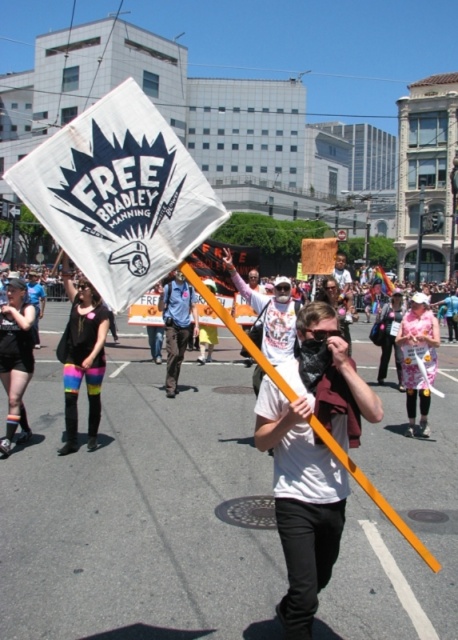
Is white matte t-shirt at center bigger than rainbow striped leggings at left?

Actually, white matte t-shirt at center might be smaller than rainbow striped leggings at left.

Can you confirm if white matte t-shirt at center is positioned to the left of rainbow striped leggings at left?

In fact, white matte t-shirt at center is to the right of rainbow striped leggings at left.

Find the location of `white matte t-shirt at center`. white matte t-shirt at center is located at coordinates click(x=311, y=458).

The image size is (458, 640). Identify the location of white matte t-shirt at center. (311, 458).

From the picture: Who is more distant from viewer, [409,381] or [185,344]?

Point [185,344]

Does point (413, 353) lie behind point (174, 339)?

No, it is in front of (174, 339).

Where is `pink floral dress at center`? pink floral dress at center is located at coordinates (418, 358).

Does point (103, 312) lie behind point (412, 406)?

That is False.

At what (x,y) coordinates should I click in order to perform the action: click on rainbow leggings at center. Please return your answer as a coordinate pair (x, y). The width and height of the screenshot is (458, 640). Looking at the image, I should click on (81, 356).